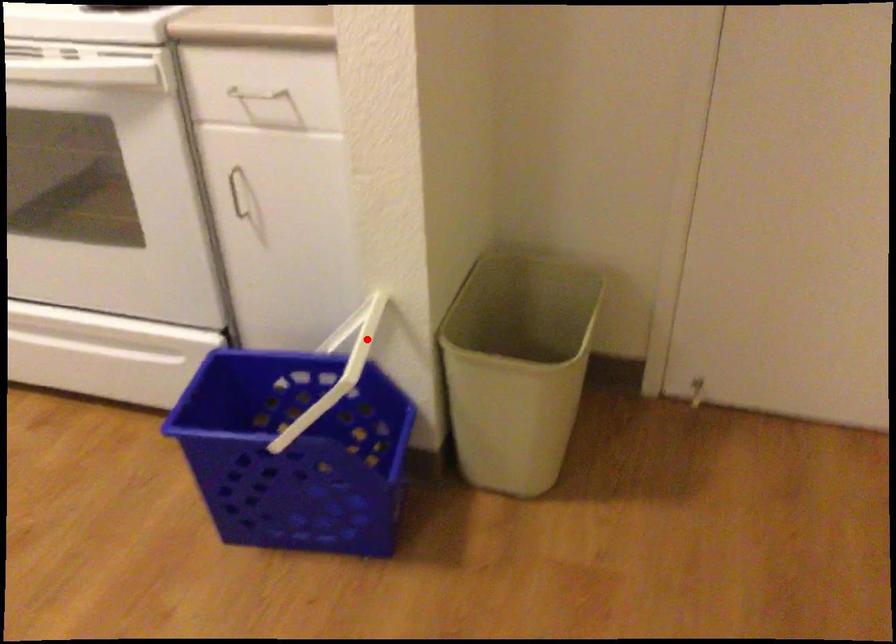
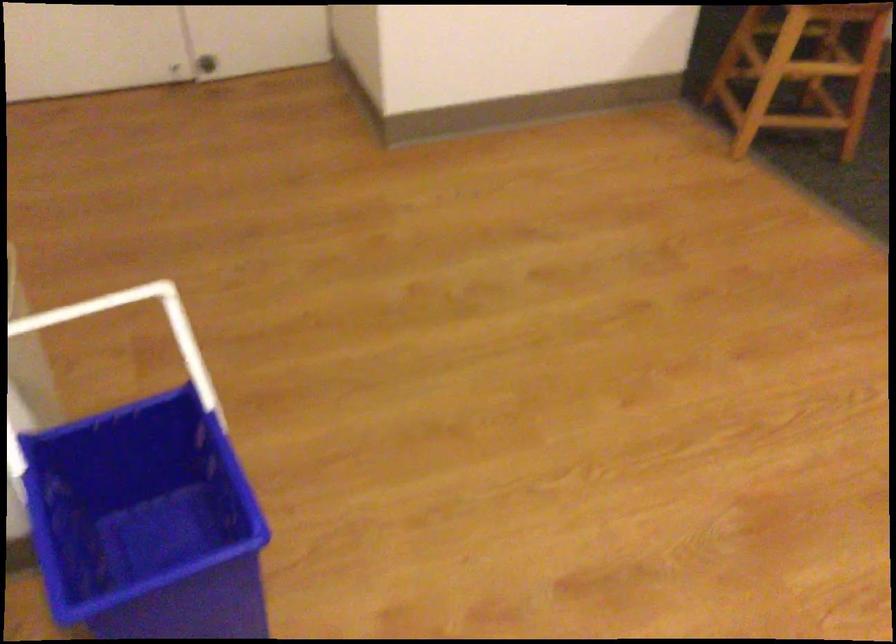
The point at the highlighted location is marked in the first image. Where is the corresponding point in the second image?

(58, 316)